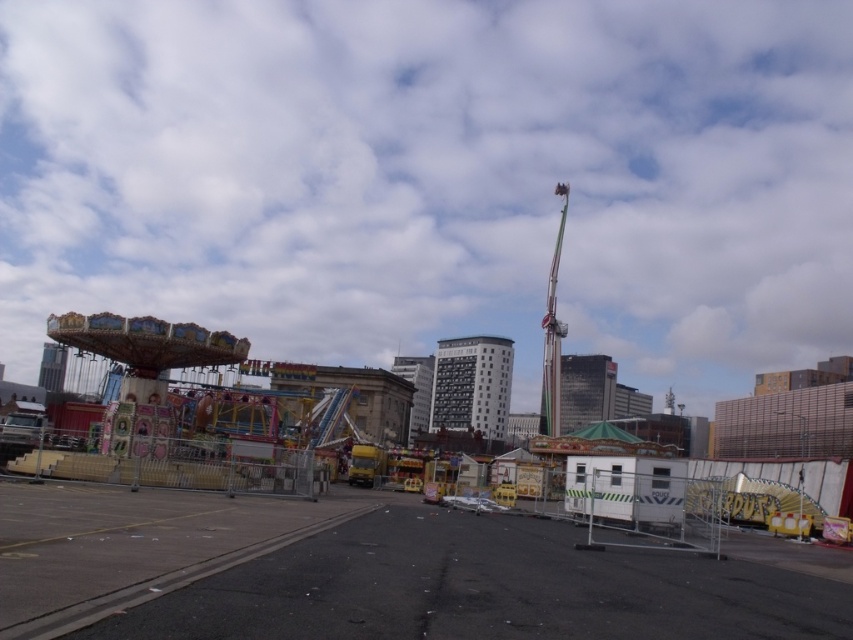
Is metallic fairground at center further to the viewer compared to multicolored painted carousel at left?

No, metallic fairground at center is closer to the viewer.

Is point (352, 602) farther from camera compared to point (177, 468)?

No, (352, 602) is in front of (177, 468).

Where is `metallic fairground at center`? metallic fairground at center is located at coordinates (376, 573).